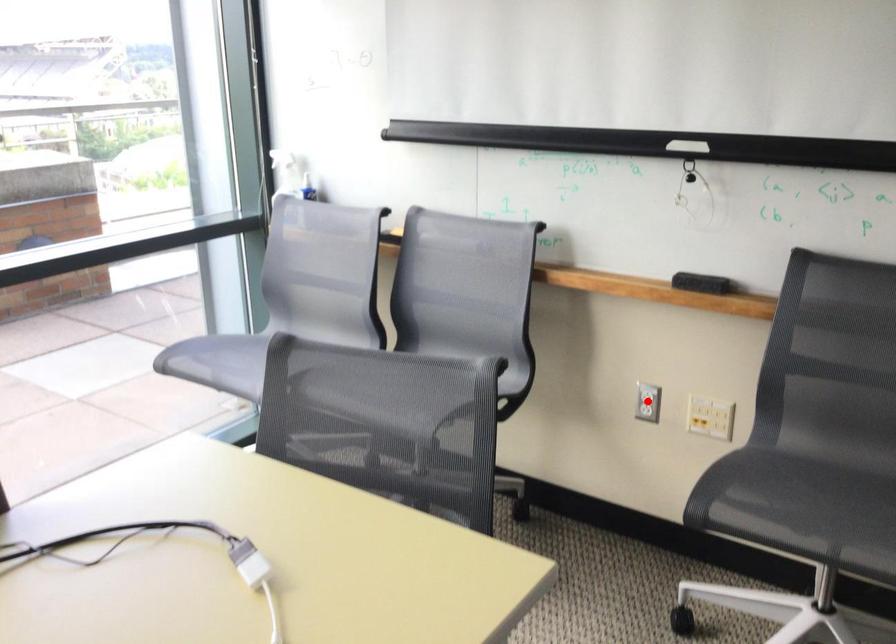
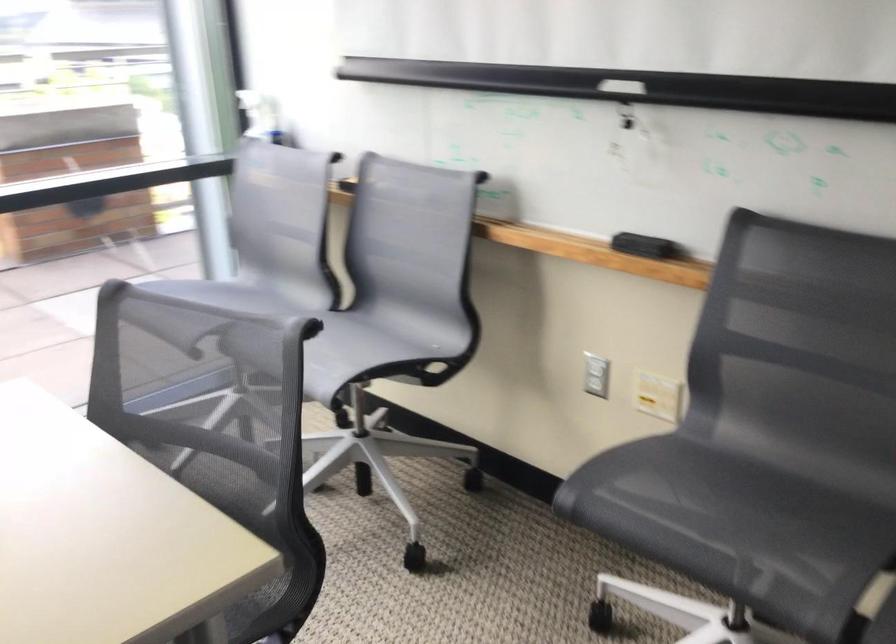
Question: I am providing you with two images of the same scene from different viewpoints. Image1 has a red point marked. In image2, the corresponding 3D location appears at what relative position? Reply with the corresponding letter.

Choices:
 (A) Closer
 (B) Farther

Answer: (A)